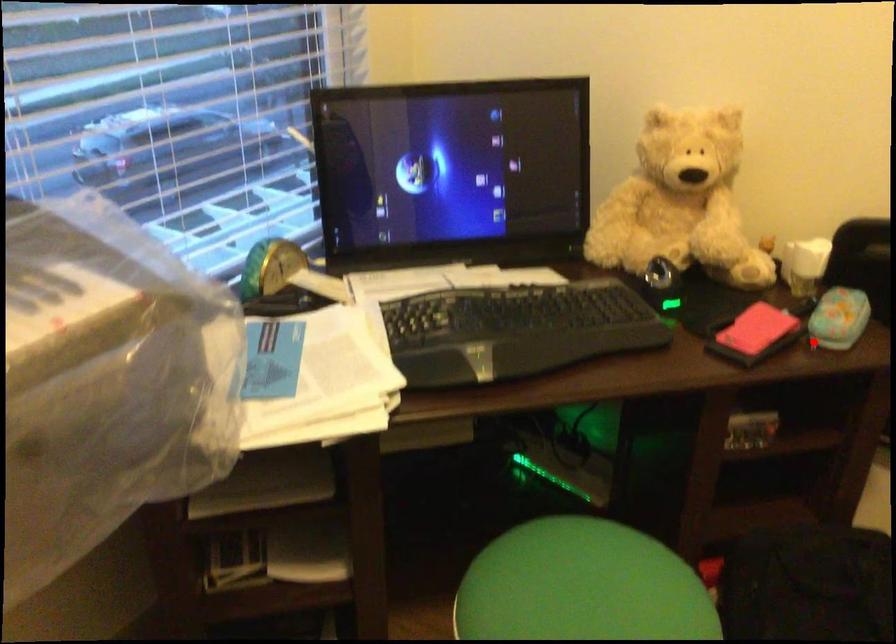
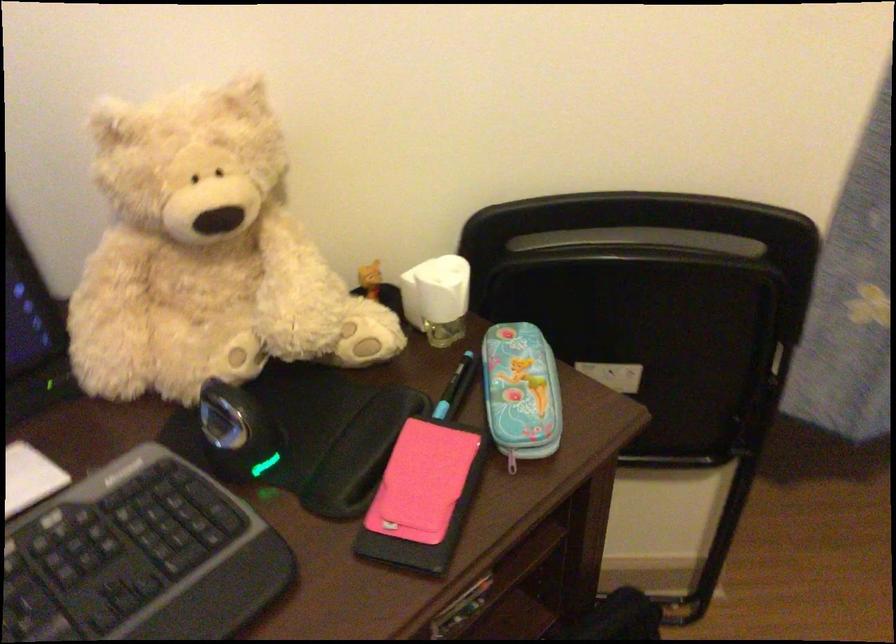
Where in the second image is the point corresponding to the highlighted location from the first image?

(512, 460)